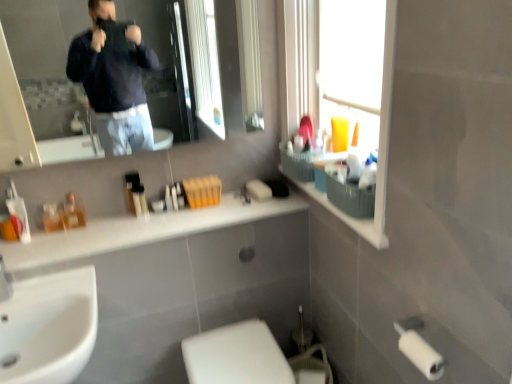
The image size is (512, 384). I want to click on free point in front of translucent plastic bottles at left, the third toiletry in the right-to-left sequence, so click(48, 245).